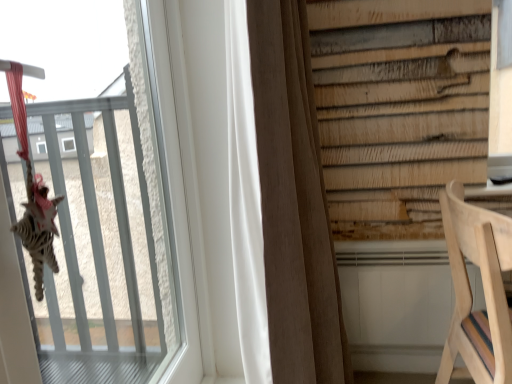
Question: From the image's perspective, is natural wood chair at lower right located beneath transparent glass window at upper left?

Choices:
 (A) no
 (B) yes

Answer: (B)

Question: Can you confirm if natural wood chair at lower right is shorter than transparent glass window at upper left?

Choices:
 (A) no
 (B) yes

Answer: (B)

Question: Is natural wood chair at lower right facing away from transparent glass window at upper left?

Choices:
 (A) no
 (B) yes

Answer: (B)

Question: Is natural wood chair at lower right wider than transparent glass window at upper left?

Choices:
 (A) yes
 (B) no

Answer: (A)

Question: Can you confirm if natural wood chair at lower right is thinner than transparent glass window at upper left?

Choices:
 (A) no
 (B) yes

Answer: (A)

Question: From a real-world perspective, is transparent glass window at upper left above or below natural wood chair at lower right?

Choices:
 (A) below
 (B) above

Answer: (B)

Question: Based on their sizes in the image, would you say transparent glass window at upper left is bigger or smaller than natural wood chair at lower right?

Choices:
 (A) big
 (B) small

Answer: (B)

Question: In the image, is transparent glass window at upper left on the left side or the right side of natural wood chair at lower right?

Choices:
 (A) right
 (B) left

Answer: (B)

Question: Choose the correct answer: Is transparent glass window at upper left inside natural wood chair at lower right or outside it?

Choices:
 (A) inside
 (B) outside

Answer: (B)

Question: Is transparent glass window at upper left wider or thinner than brown fabric curtain at center?

Choices:
 (A) thin
 (B) wide

Answer: (A)

Question: Does point (15, 148) appear closer or farther from the camera than point (275, 372)?

Choices:
 (A) farther
 (B) closer

Answer: (B)

Question: Relative to brown fabric curtain at center, is transparent glass window at upper left in front or behind?

Choices:
 (A) behind
 (B) front

Answer: (B)

Question: From the image's perspective, is transparent glass window at upper left above or below brown fabric curtain at center?

Choices:
 (A) below
 (B) above

Answer: (A)

Question: Is brown fabric curtain at center wider or thinner than transparent glass window at upper left?

Choices:
 (A) thin
 (B) wide

Answer: (B)

Question: Considering the positions of point (311, 160) and point (147, 226), is point (311, 160) closer or farther from the camera than point (147, 226)?

Choices:
 (A) closer
 (B) farther

Answer: (A)